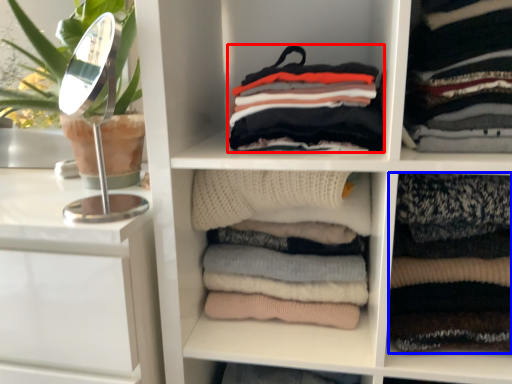
Question: Which object appears closest to the camera in this image, clothing (highlighted by a red box) or clothing (highlighted by a blue box)?

Choices:
 (A) clothing
 (B) clothing

Answer: (A)